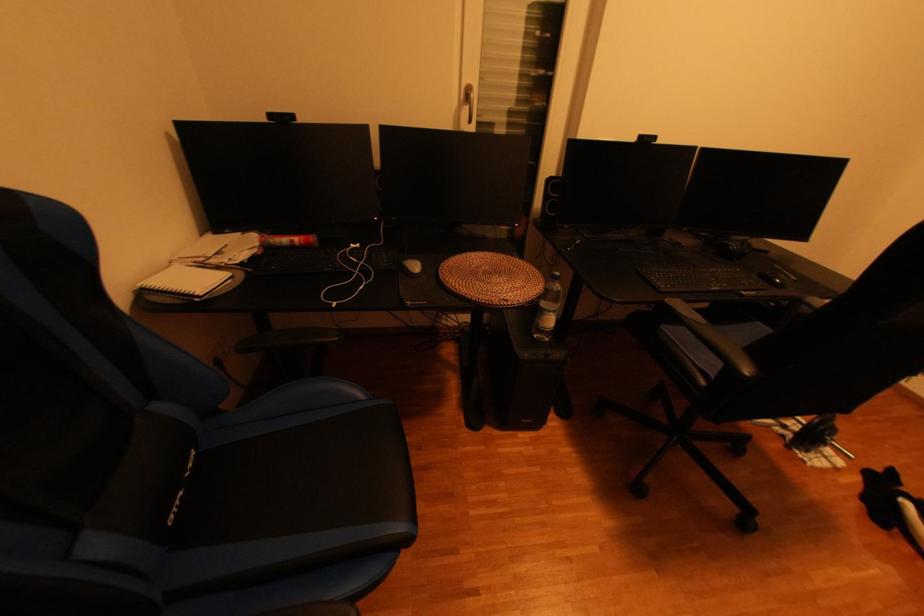
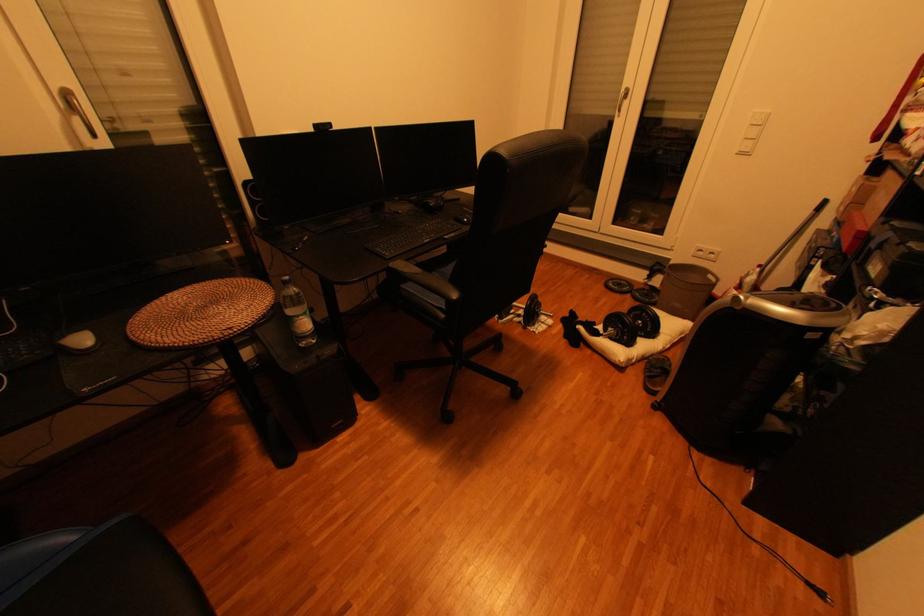
The point at (855, 469) is marked in the first image. Where is the corresponding point in the second image?

(564, 323)